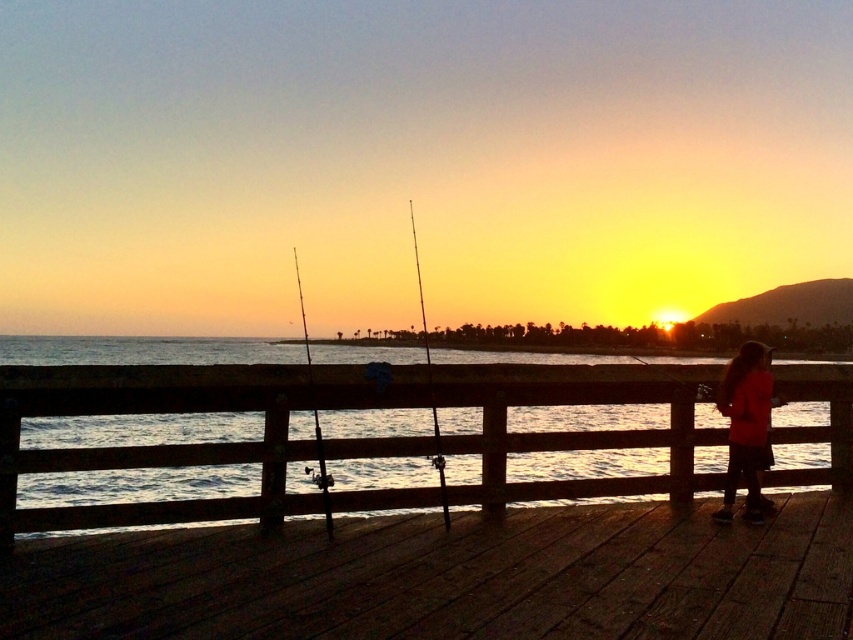
How much distance is there between silky red dress at lower right and silhouette rod at center?

The distance of silky red dress at lower right from silhouette rod at center is 4.79 meters.

Is silky red dress at lower right to the left of silhouette rod at center from the viewer's perspective?

No, silky red dress at lower right is not to the left of silhouette rod at center.

Where is `silky red dress at lower right`? Image resolution: width=853 pixels, height=640 pixels. silky red dress at lower right is located at coordinates (746, 426).

Between silky red dress at lower right and metallic fishing pole at center, which one appears on the left side from the viewer's perspective?

metallic fishing pole at center is more to the left.

Which is more to the right, silky red dress at lower right or metallic fishing pole at center?

From the viewer's perspective, silky red dress at lower right appears more on the right side.

The image size is (853, 640). Describe the element at coordinates (746, 426) in the screenshot. I see `silky red dress at lower right` at that location.

Where is `silky red dress at lower right`? The image size is (853, 640). silky red dress at lower right is located at coordinates (746, 426).

Is dark wood dock at lower center thinner than wooden water at center?

No.

Find the location of a particular element. The height and width of the screenshot is (640, 853). dark wood dock at lower center is located at coordinates (450, 579).

Does point (410, 573) come in front of point (782, 372)?

Yes, it is.

This screenshot has height=640, width=853. What are the coordinates of `dark wood dock at lower center` in the screenshot? It's located at (450, 579).